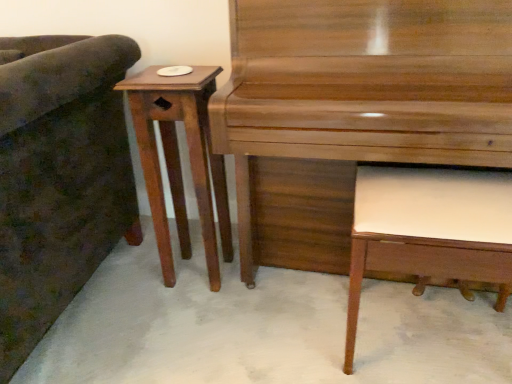
Measure the distance between mahogany wood side table at left and camera.

The distance of mahogany wood side table at left from camera is 1.21 meters.

You are a GUI agent. You are given a task and a screenshot of the screen. Output one action in this format:
    pyautogui.click(x=<x>, y=<y>)
    Task: Click on the shiny brown piano at center
    The width and height of the screenshot is (512, 384).
    Given the screenshot: What is the action you would take?
    pyautogui.click(x=352, y=110)

Identify the location of mahogany wood side table at left. (179, 160).

Is mahogany wood side table at left facing towards dark green fabric couch at left?

No, mahogany wood side table at left does not turn towards dark green fabric couch at left.

What's the angular difference between mahogany wood side table at left and dark green fabric couch at left's facing directions?

mahogany wood side table at left and dark green fabric couch at left are facing 2.61 degrees away from each other.

Which of these two, mahogany wood side table at left or dark green fabric couch at left, is wider?

dark green fabric couch at left.

Is mahogany wood side table at left inside or outside of dark green fabric couch at left?

mahogany wood side table at left cannot be found inside dark green fabric couch at left.

Looking at the image, does white leather music stool at lower right seem bigger or smaller compared to dark green fabric couch at left?

white leather music stool at lower right is smaller than dark green fabric couch at left.

Which of these two, white leather music stool at lower right or dark green fabric couch at left, stands taller?

dark green fabric couch at left.

Can you confirm if white leather music stool at lower right is thinner than dark green fabric couch at left?

Correct, the width of white leather music stool at lower right is less than that of dark green fabric couch at left.

Considering the relative positions of shiny brown piano at center and white leather music stool at lower right in the image provided, is shiny brown piano at center to the left or to the right of white leather music stool at lower right?

Based on their positions, shiny brown piano at center is located to the left of white leather music stool at lower right.

Which is in front, point (244, 280) or point (419, 237)?

Positioned in front is point (419, 237).

Which object is closer to the camera taking this photo, shiny brown piano at center or white leather music stool at lower right?

shiny brown piano at center is closer to the camera.

Looking at their sizes, would you say dark green fabric couch at left is wider or thinner than shiny brown piano at center?

dark green fabric couch at left is wider than shiny brown piano at center.

Considering the sizes of objects dark green fabric couch at left and shiny brown piano at center in the image provided, who is taller, dark green fabric couch at left or shiny brown piano at center?

With more height is shiny brown piano at center.

Is dark green fabric couch at left outside of shiny brown piano at center?

Indeed, dark green fabric couch at left is completely outside shiny brown piano at center.

Does dark green fabric couch at left have a larger size compared to shiny brown piano at center?

Yes, dark green fabric couch at left is bigger than shiny brown piano at center.

Is mahogany wood side table at left oriented away from white leather music stool at lower right?

That's not correct — mahogany wood side table at left is not looking away from white leather music stool at lower right.

Consider the image. Considering the positions of objects mahogany wood side table at left and white leather music stool at lower right in the image provided, who is more to the right, mahogany wood side table at left or white leather music stool at lower right?

white leather music stool at lower right.

Would you say white leather music stool at lower right is part of mahogany wood side table at left's contents?

Definitely not — white leather music stool at lower right is not inside mahogany wood side table at left.

Considering the positions of objects mahogany wood side table at left and white leather music stool at lower right in the image provided, who is behind, mahogany wood side table at left or white leather music stool at lower right?

mahogany wood side table at left.

Is dark green fabric couch at left facing away from white leather music stool at lower right?

dark green fabric couch at left does not have its back to white leather music stool at lower right.

Image resolution: width=512 pixels, height=384 pixels. In order to click on furniture lying on the left of white leather music stool at lower right in this screenshot , I will do tap(59, 177).

Choose the correct answer: Is dark green fabric couch at left inside white leather music stool at lower right or outside it?

dark green fabric couch at left exists outside the volume of white leather music stool at lower right.

Considering the sizes of objects dark green fabric couch at left and white leather music stool at lower right in the image provided, who is wider, dark green fabric couch at left or white leather music stool at lower right?

dark green fabric couch at left is wider.

Identify the location of table above the dark green fabric couch at left (from the image's perspective). (179, 160).

Is dark green fabric couch at left placed right next to mahogany wood side table at left?

→ There is a gap between dark green fabric couch at left and mahogany wood side table at left.

Which of these two, dark green fabric couch at left or mahogany wood side table at left, is thinner?

mahogany wood side table at left.

From the image's perspective, between dark green fabric couch at left and mahogany wood side table at left, which one is located above?

mahogany wood side table at left.

In order to click on furniture on the left side of mahogany wood side table at left in this screenshot , I will do `click(59, 177)`.

The width and height of the screenshot is (512, 384). What are the coordinates of `music stool below the dark green fabric couch at left (from the image's perspective)` in the screenshot? It's located at (x=430, y=231).

When comparing their distances from white leather music stool at lower right, does dark green fabric couch at left or mahogany wood side table at left seem closer?

Based on the image, mahogany wood side table at left appears to be nearer to white leather music stool at lower right.

When comparing their distances from shiny brown piano at center, does dark green fabric couch at left or mahogany wood side table at left seem further?

dark green fabric couch at left lies further to shiny brown piano at center than the other object.

Looking at the image, which one is located closer to shiny brown piano at center, white leather music stool at lower right or mahogany wood side table at left?

The object closer to shiny brown piano at center is white leather music stool at lower right.

Based on their spatial positions, is dark green fabric couch at left or white leather music stool at lower right further from mahogany wood side table at left?

Among the two, white leather music stool at lower right is located further to mahogany wood side table at left.

Which object lies nearer to the anchor point white leather music stool at lower right, shiny brown piano at center or mahogany wood side table at left?

shiny brown piano at center lies closer to white leather music stool at lower right than the other object.

Based on their spatial positions, is white leather music stool at lower right or shiny brown piano at center further from mahogany wood side table at left?

The object further to mahogany wood side table at left is white leather music stool at lower right.

When comparing their distances from dark green fabric couch at left, does white leather music stool at lower right or mahogany wood side table at left seem closer?

mahogany wood side table at left.

Consider the image. Estimate the real-world distances between objects in this image. Which object is closer to white leather music stool at lower right, dark green fabric couch at left or shiny brown piano at center?

shiny brown piano at center is positioned closer to the anchor white leather music stool at lower right.

The image size is (512, 384). Find the location of `piano between dark green fabric couch at left and white leather music stool at lower right`. piano between dark green fabric couch at left and white leather music stool at lower right is located at coordinates (352, 110).

I want to click on piano between mahogany wood side table at left and white leather music stool at lower right in the horizontal direction, so click(352, 110).

What are the coordinates of `table between dark green fabric couch at left and white leather music stool at lower right from left to right` in the screenshot? It's located at (179, 160).

Identify the location of table located between dark green fabric couch at left and shiny brown piano at center in the left-right direction. The height and width of the screenshot is (384, 512). [x=179, y=160].